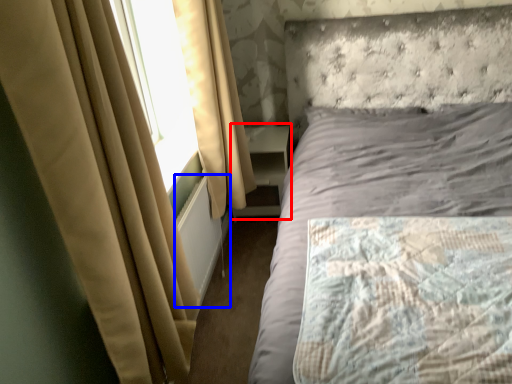
Question: Which object appears closest to the camera in this image, bookshelf (highlighted by a red box) or radiator (highlighted by a blue box)?

Choices:
 (A) bookshelf
 (B) radiator

Answer: (B)